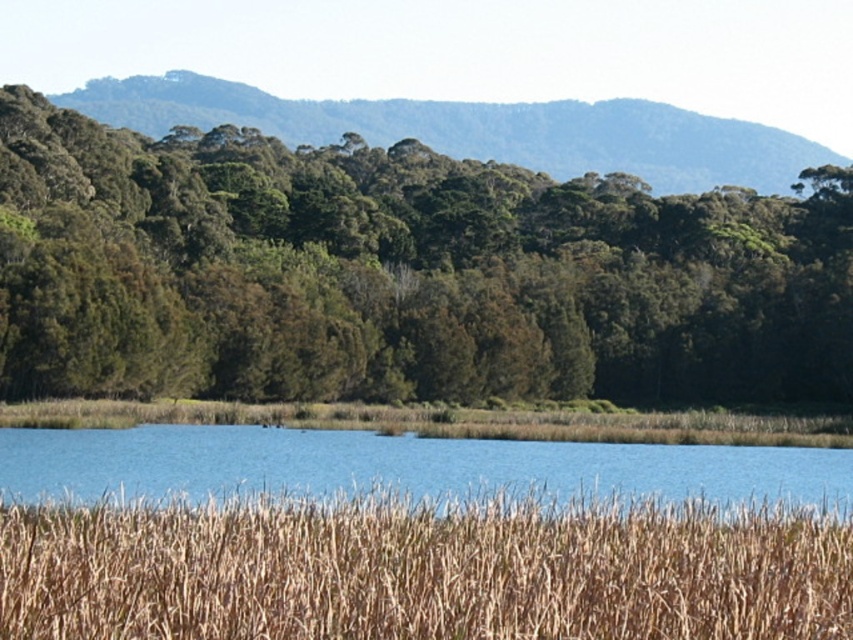
Which is in front, point (691, 364) or point (772, 529)?

Point (772, 529) is in front.

Does green leafy trees at center lie in front of dry grass at lower center?

No.

Measure the distance between green leafy trees at center and camera.

A distance of 305.14 feet exists between green leafy trees at center and camera.

Identify the location of green leafy trees at center. The height and width of the screenshot is (640, 853). (399, 275).

Is point (32, 634) less distant than point (26, 429)?

That is True.

Looking at this image, who is shorter, dry grass at lower center or blue water at center?

dry grass at lower center

Does point (426, 515) lie in front of point (786, 448)?

Yes, it is.

This screenshot has width=853, height=640. I want to click on dry grass at lower center, so click(422, 570).

Find the location of a particular element. Image resolution: width=853 pixels, height=640 pixels. green leafy trees at center is located at coordinates (399, 275).

Can you confirm if green leafy trees at center is shorter than blue water at center?

No, green leafy trees at center is not shorter than blue water at center.

From the picture: Who is more distant from viewer, (730,307) or (225,451)?

The point (730,307) is more distant.

The width and height of the screenshot is (853, 640). What are the coordinates of `green leafy trees at center` in the screenshot? It's located at (399, 275).